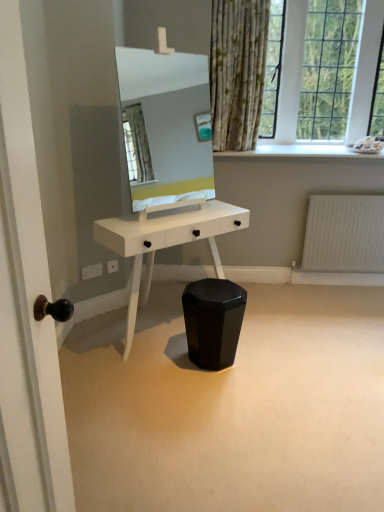
Find the location of a particular element. The height and width of the screenshot is (512, 384). vacant area that lies to the right of white glossy table at center is located at coordinates (301, 355).